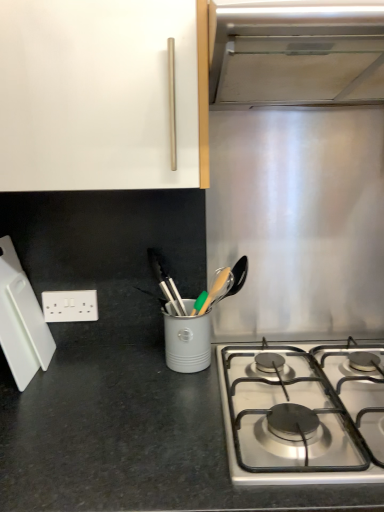
Question: From the image's perspective, does white glossy cabinet handle at upper center appear lower than stainless steel gas stove at lower right?

Choices:
 (A) yes
 (B) no

Answer: (B)

Question: Is white glossy cabinet handle at upper center at the right side of stainless steel gas stove at lower right?

Choices:
 (A) yes
 (B) no

Answer: (B)

Question: From the image's perspective, is white glossy cabinet handle at upper center over stainless steel gas stove at lower right?

Choices:
 (A) no
 (B) yes

Answer: (B)

Question: From a real-world perspective, does white glossy cabinet handle at upper center stand above stainless steel gas stove at lower right?

Choices:
 (A) yes
 (B) no

Answer: (A)

Question: Is white glossy cabinet handle at upper center smaller than stainless steel gas stove at lower right?

Choices:
 (A) no
 (B) yes

Answer: (A)

Question: From the image's perspective, is white plastic cutting board at left above or below stainless steel vent at upper right?

Choices:
 (A) below
 (B) above

Answer: (A)

Question: In terms of width, does white plastic cutting board at left look wider or thinner when compared to stainless steel vent at upper right?

Choices:
 (A) wide
 (B) thin

Answer: (B)

Question: Is white plastic cutting board at left spatially inside stainless steel vent at upper right, or outside of it?

Choices:
 (A) outside
 (B) inside

Answer: (A)

Question: Considering the positions of white plastic cutting board at left and stainless steel vent at upper right in the image, is white plastic cutting board at left taller or shorter than stainless steel vent at upper right?

Choices:
 (A) tall
 (B) short

Answer: (A)

Question: Based on their sizes in the image, would you say stainless steel gas stove at lower right is bigger or smaller than white plastic cutting board at left?

Choices:
 (A) small
 (B) big

Answer: (B)

Question: From the image's perspective, relative to white plastic cutting board at left, is stainless steel gas stove at lower right above or below?

Choices:
 (A) above
 (B) below

Answer: (B)

Question: Relative to white plastic cutting board at left, is stainless steel gas stove at lower right in front or behind?

Choices:
 (A) front
 (B) behind

Answer: (A)

Question: Looking at their shapes, would you say stainless steel gas stove at lower right is wider or thinner than white plastic cutting board at left?

Choices:
 (A) wide
 (B) thin

Answer: (A)

Question: Is point (44, 333) closer or farther from the camera than point (71, 297)?

Choices:
 (A) closer
 (B) farther

Answer: (A)

Question: From the image's perspective, is white plastic cutting board at left positioned above or below white plastic electric outlet at lower left?

Choices:
 (A) above
 (B) below

Answer: (A)